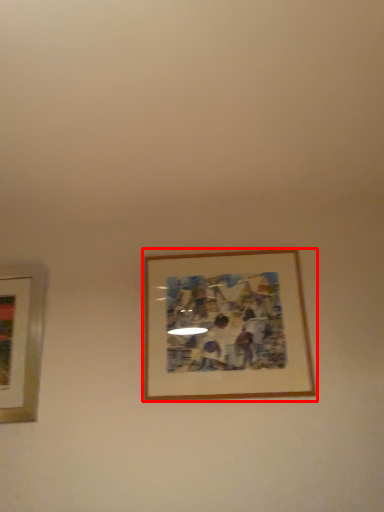
Question: Where is picture frame (annotated by the red box) located in relation to picture frame in the image?

Choices:
 (A) right
 (B) left

Answer: (A)